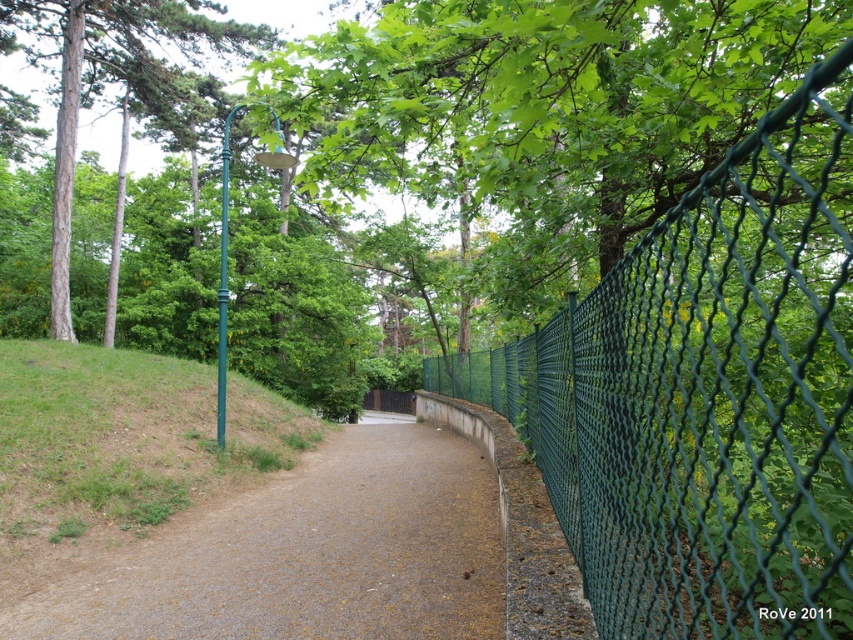
You are a gardener who needs to water the plants along the brown gravel trail at center. You have a hose that can reach 2 meters. Can you water the plants near the green mesh fence at right without moving the hose? Please explain.

The distance between the green mesh fence at right and the brown gravel trail at center is 2.33 meters. Since the hose can only reach 2 meters, it is not long enough to reach the fence from the trail. Therefore, you cannot water the plants near the green mesh fence at right without moving the hose.